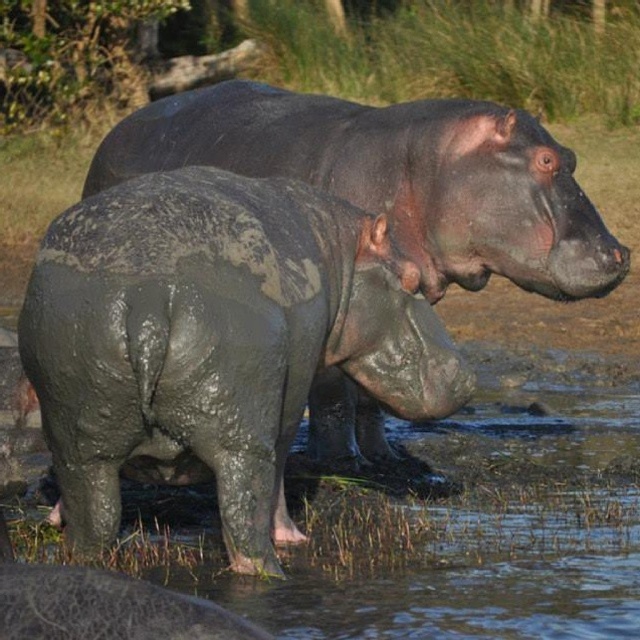
Question: Is muddy water at lower center positioned before muddy gray hippo at center?

Choices:
 (A) no
 (B) yes

Answer: (B)

Question: Which object appears closest to the camera in this image?

Choices:
 (A) muddy water at lower center
 (B) muddy gray elephant at lower left

Answer: (B)

Question: Can you confirm if muddy gray elephant at lower left is positioned below muddy gray hippo at center?

Choices:
 (A) yes
 (B) no

Answer: (A)

Question: Is muddy gray elephant at lower left in front of muddy gray hippo at center?

Choices:
 (A) no
 (B) yes

Answer: (B)

Question: Estimate the real-world distances between objects in this image. Which object is closer to the muddy gray elephant at lower left?

Choices:
 (A) muddy water at lower center
 (B) muddy gray hippo at center

Answer: (A)

Question: Which point appears closest to the camera in this image?

Choices:
 (A) (240, 320)
 (B) (372, 589)
 (C) (291, 150)

Answer: (A)